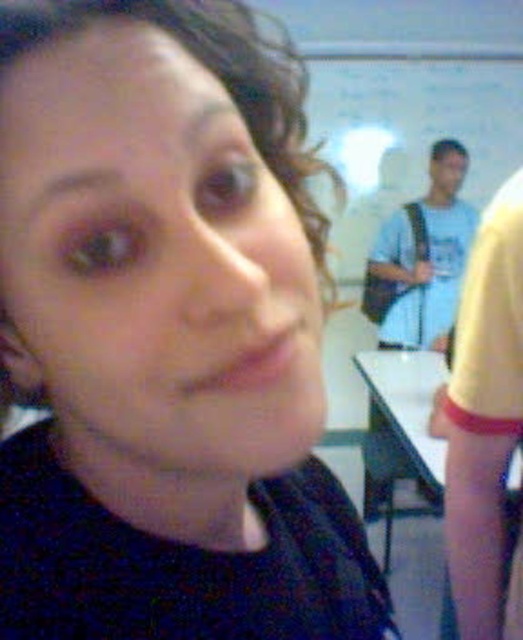
Question: Which point is closer to the camera?

Choices:
 (A) (429, 212)
 (B) (520, 403)
 (C) (376, 100)
 (D) (374, 440)

Answer: (B)

Question: Which of the following is the closest to the observer?

Choices:
 (A) (373, 502)
 (B) (491, 458)
 (C) (331, 97)

Answer: (B)

Question: Can you confirm if whiteboard at upper center is positioned to the left of light blue t-shirt at upper right?

Choices:
 (A) no
 (B) yes

Answer: (A)

Question: Where is yellow fabric at right located in relation to white glossy table at lower right in the image?

Choices:
 (A) left
 (B) right

Answer: (A)

Question: Estimate the real-world distances between objects in this image. Which object is closer to the light blue t-shirt at upper right?

Choices:
 (A) yellow fabric at right
 (B) white glossy table at lower right
 (C) whiteboard at upper center

Answer: (C)

Question: Is whiteboard at upper center wider than white glossy table at lower right?

Choices:
 (A) yes
 (B) no

Answer: (A)